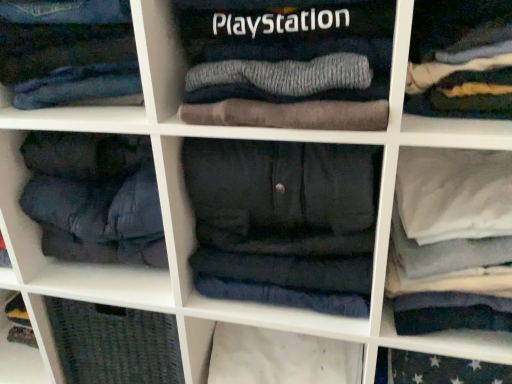
Question: From the image's perspective, is denim jeans at upper center, marked as the second clothing in a bottom-to-top arrangement, located beneath dark gray fleece pants at center, which is counted as the 2th clothing, starting from the top?

Choices:
 (A) no
 (B) yes

Answer: (A)

Question: Is denim jeans at upper center, marked as the second clothing in a bottom-to-top arrangement, positioned with its back to dark gray fleece pants at center, which ranks as the first clothing in bottom-to-top order?

Choices:
 (A) yes
 (B) no

Answer: (B)

Question: Is denim jeans at upper center, marked as the second clothing in a bottom-to-top arrangement, outside of dark gray fleece pants at center, arranged as the 1th clothing when viewed from the right?

Choices:
 (A) yes
 (B) no

Answer: (A)

Question: Is the depth of denim jeans at upper center, the first clothing viewed from the top, greater than that of dark gray fleece pants at center, which is counted as the 2th clothing, starting from the top?

Choices:
 (A) yes
 (B) no

Answer: (B)

Question: Considering the relative positions of denim jeans at upper center, which ranks as the second clothing in right-to-left order, and dark gray fleece pants at center, arranged as the 1th clothing when viewed from the right, in the image provided, is denim jeans at upper center, which ranks as the second clothing in right-to-left order, to the right of dark gray fleece pants at center, arranged as the 1th clothing when viewed from the right, from the viewer's perspective?

Choices:
 (A) no
 (B) yes

Answer: (A)

Question: Are denim jeans at upper center, marked as the second clothing in a bottom-to-top arrangement, and dark gray fleece pants at center, which ranks as the first clothing in bottom-to-top order, far apart?

Choices:
 (A) no
 (B) yes

Answer: (A)

Question: From a real-world perspective, is dark gray fleece pants at center, arranged as the 1th clothing when viewed from the right, positioned over denim jeans at upper center, the first clothing viewed from the top, based on gravity?

Choices:
 (A) yes
 (B) no

Answer: (B)

Question: Is dark gray fleece pants at center, arranged as the 1th clothing when viewed from the right, positioned behind denim jeans at upper center, positioned as the first clothing in left-to-right order?

Choices:
 (A) no
 (B) yes

Answer: (B)

Question: Is dark gray fleece pants at center, which is counted as the second clothing, starting from the left, smaller than denim jeans at upper center, positioned as the first clothing in left-to-right order?

Choices:
 (A) no
 (B) yes

Answer: (A)

Question: Is dark gray fleece pants at center, which is counted as the 2th clothing, starting from the top, aimed at denim jeans at upper center, marked as the second clothing in a bottom-to-top arrangement?

Choices:
 (A) no
 (B) yes

Answer: (A)

Question: Is dark gray fleece pants at center, which is counted as the 2th clothing, starting from the top, positioned with its back to denim jeans at upper center, the first clothing viewed from the top?

Choices:
 (A) no
 (B) yes

Answer: (A)

Question: Is dark gray fleece pants at center, which is counted as the 2th clothing, starting from the top, in contact with denim jeans at upper center, marked as the second clothing in a bottom-to-top arrangement?

Choices:
 (A) yes
 (B) no

Answer: (B)

Question: From a real-world perspective, is dark gray fleece pants at center, arranged as the 1th clothing when viewed from the right, positioned above or below denim jeans at upper center, marked as the second clothing in a bottom-to-top arrangement?

Choices:
 (A) below
 (B) above

Answer: (A)